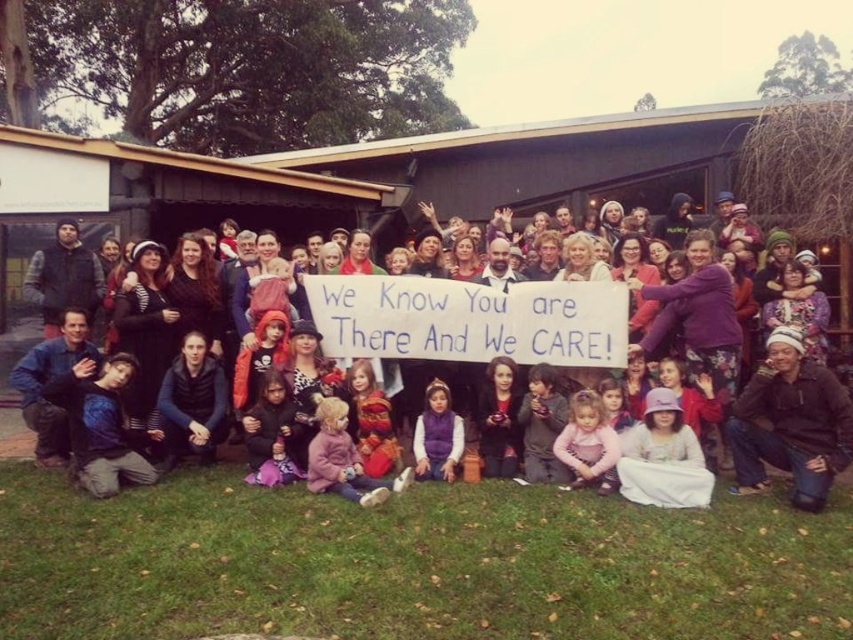
Question: Which point appears farthest from the camera in this image?

Choices:
 (A) (448, 451)
 (B) (850, 465)

Answer: (A)

Question: Can you confirm if purple fleece vest at center is positioned to the right of matte black jacket at center?

Choices:
 (A) yes
 (B) no

Answer: (A)

Question: Among these points, which one is farthest from the camera?

Choices:
 (A) (440, 419)
 (B) (3, 452)

Answer: (B)

Question: From the image, what is the correct spatial relationship of purple fleece vest at center in relation to matte black jacket at center?

Choices:
 (A) above
 (B) below

Answer: (A)

Question: In this image, where is purple fleece vest at center located relative to matte black jacket at center?

Choices:
 (A) left
 (B) right

Answer: (B)

Question: Which point is closer to the camera?

Choices:
 (A) matte black jacket at center
 (B) purple fleece vest at center

Answer: (B)